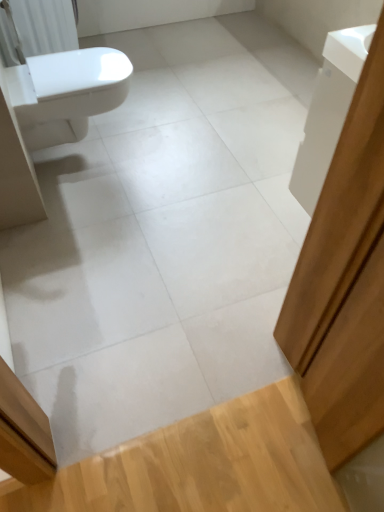
Image resolution: width=384 pixels, height=512 pixels. What are the coordinates of `vacant space underneath white glossy bidet at left (from a real-world perspective)` in the screenshot? It's located at (94, 145).